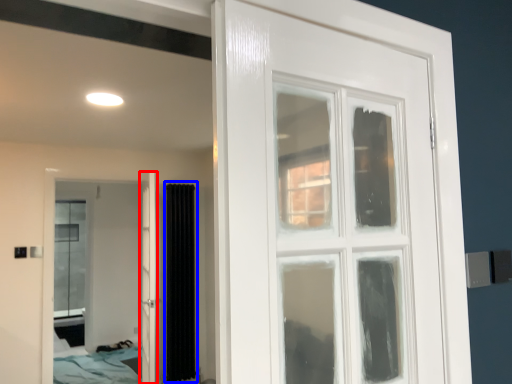
Question: Which point is further to the camera, door (highlighted by a red box) or curtain (highlighted by a blue box)?

Choices:
 (A) door
 (B) curtain

Answer: (B)